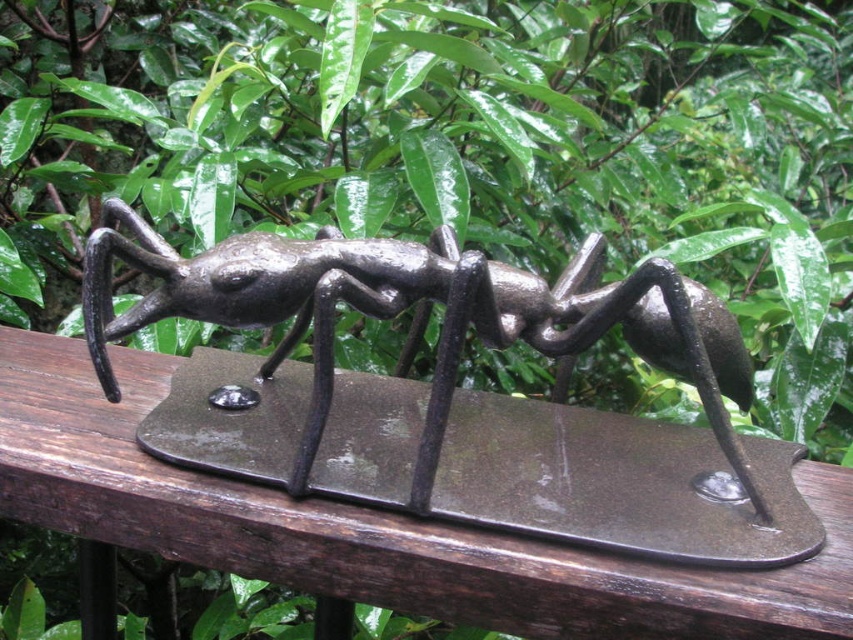
Is point (347, 509) farther from viewer compared to point (532, 326)?

No, (347, 509) is in front of (532, 326).

The image size is (853, 640). In order to click on brown wood rail at center in this screenshot , I will do `click(373, 525)`.

This screenshot has height=640, width=853. Find the location of `brown wood rail at center`. brown wood rail at center is located at coordinates (373, 525).